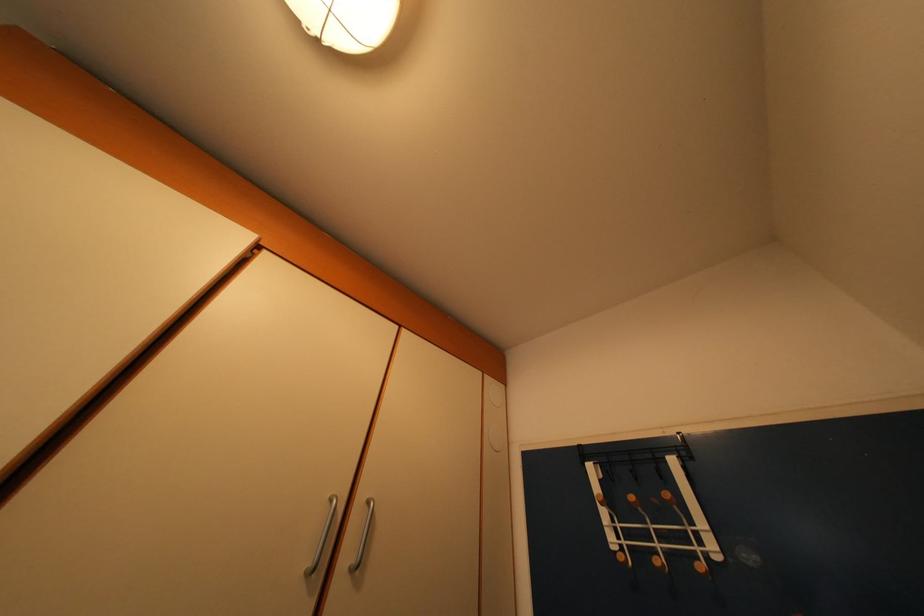
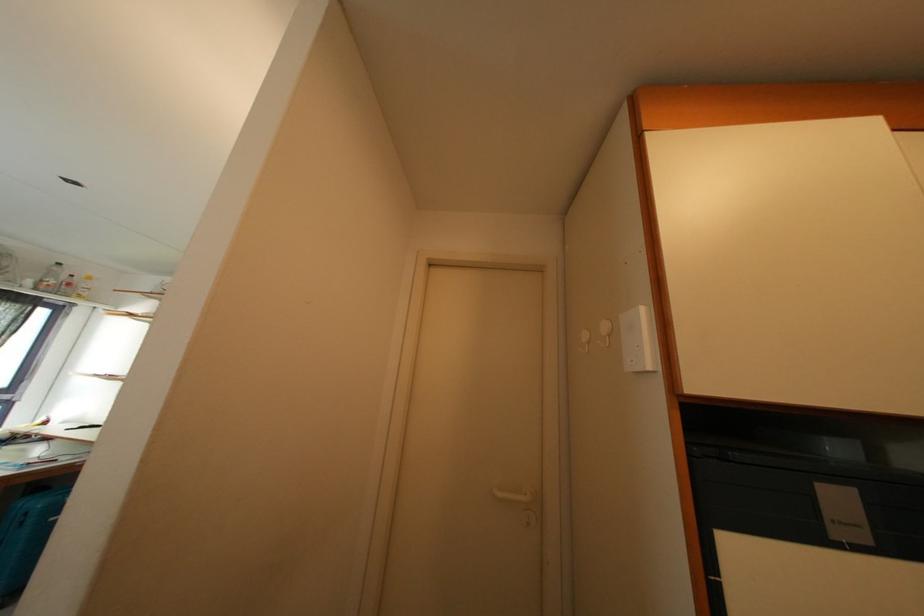
Question: The camera is either moving clockwise (left) or counter-clockwise (right) around the object. The first image is from the beginning of the video and the second image is from the end. Is the camera moving left or right when shooting the video?

Choices:
 (A) Left
 (B) Right

Answer: (B)